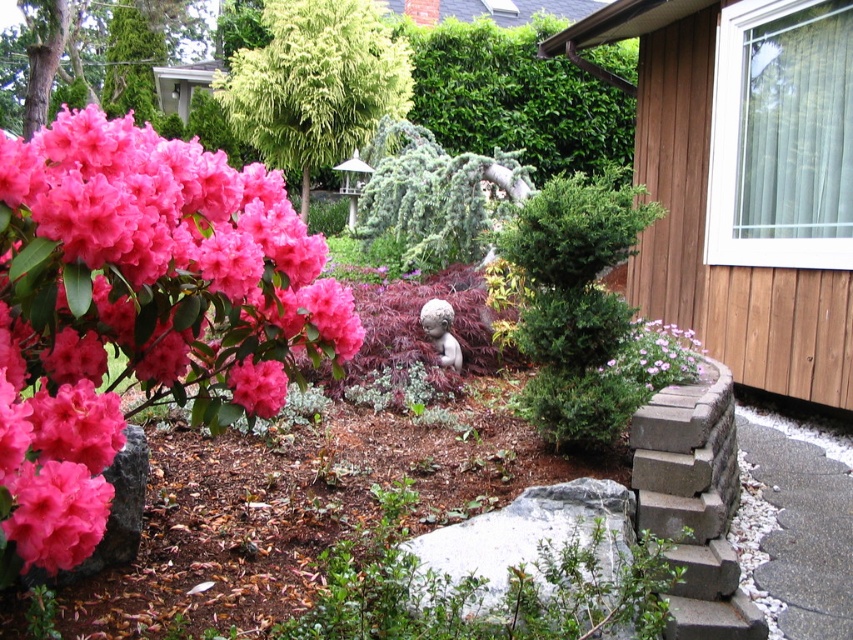
Between pink matte flower at upper left and pink matte flowers at center-right, which one has more height?

Standing taller between the two is pink matte flower at upper left.

Measure the distance from pink matte flower at upper left to pink matte flowers at center-right.

They are 17.38 meters apart.

Consider the image. Who is more forward, [100,17] or [643,324]?

Positioned in front is point [643,324].

Image resolution: width=853 pixels, height=640 pixels. Identify the location of pink matte flower at upper left. (84, 48).

Does matte pink flowers at upper left have a smaller size compared to green textured bush at center?

Correct, matte pink flowers at upper left occupies less space than green textured bush at center.

Between matte pink flowers at upper left and green textured bush at center, which one has less height?

matte pink flowers at upper left

The image size is (853, 640). What are the coordinates of `matte pink flowers at upper left` in the screenshot? It's located at (135, 307).

Is green textured bush at center below pink matte flowers at center-right?

Actually, green textured bush at center is above pink matte flowers at center-right.

I want to click on green textured bush at center, so click(x=434, y=196).